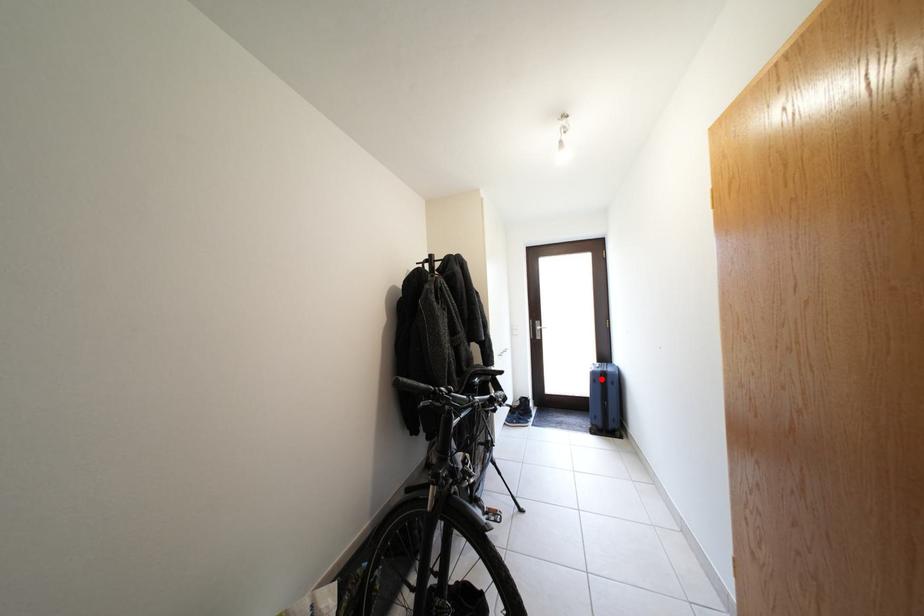
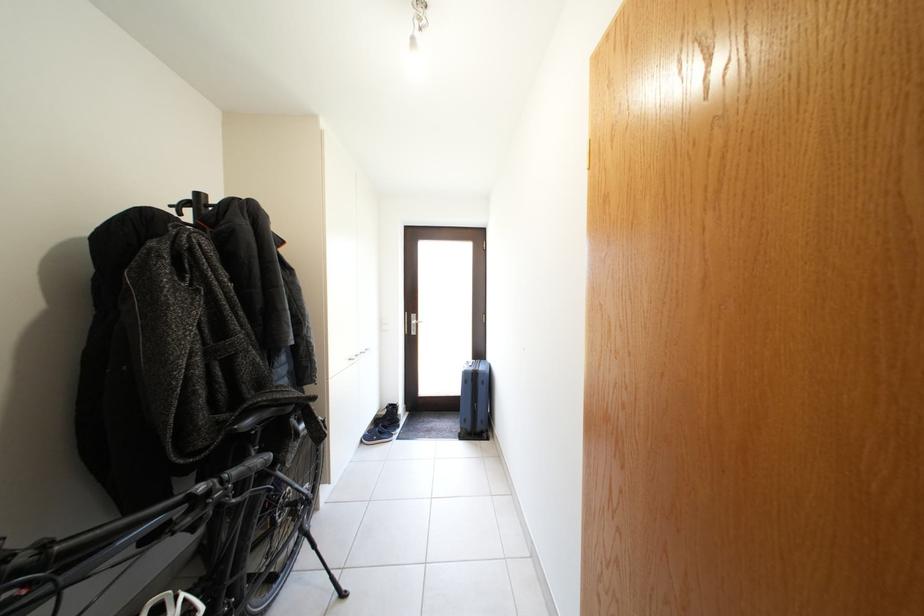
In the second image, find the point that corresponds to the highlighted location in the first image.

(473, 379)